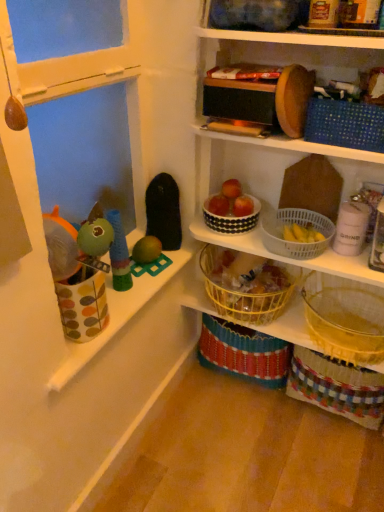
Where is `free point in front of red matte apple at center, which appears as the third apple when viewed from the left`? The height and width of the screenshot is (512, 384). free point in front of red matte apple at center, which appears as the third apple when viewed from the left is located at coordinates (257, 232).